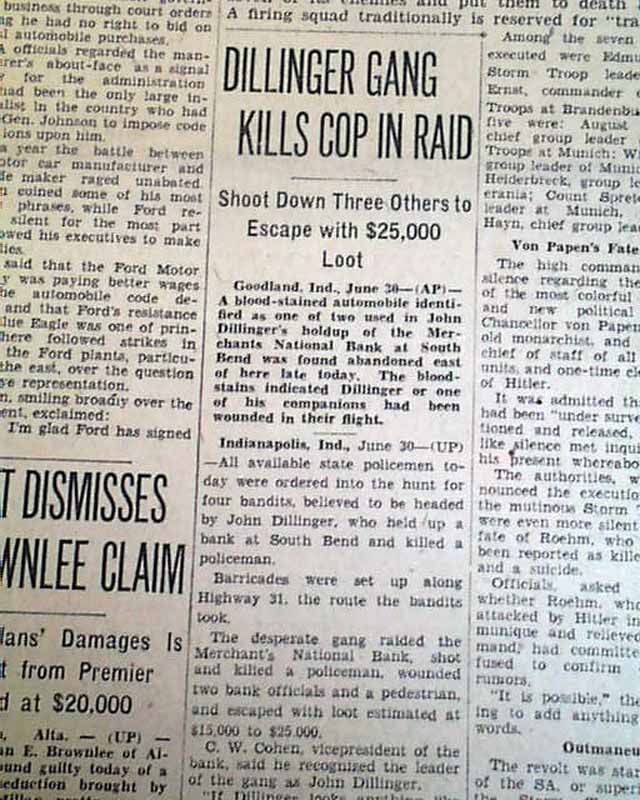
The image size is (640, 800). Identify the location of newspaper. (413, 342).